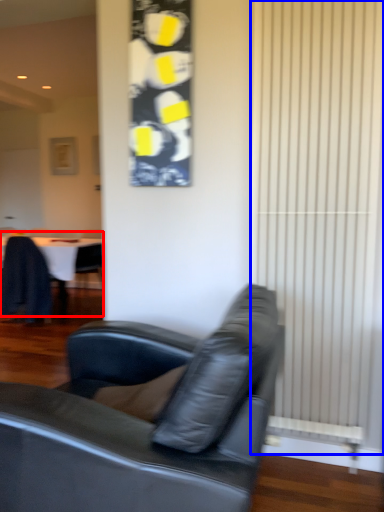
Question: Which object appears closest to the camera in this image, table (highlighted by a red box) or curtain (highlighted by a blue box)?

Choices:
 (A) table
 (B) curtain

Answer: (B)